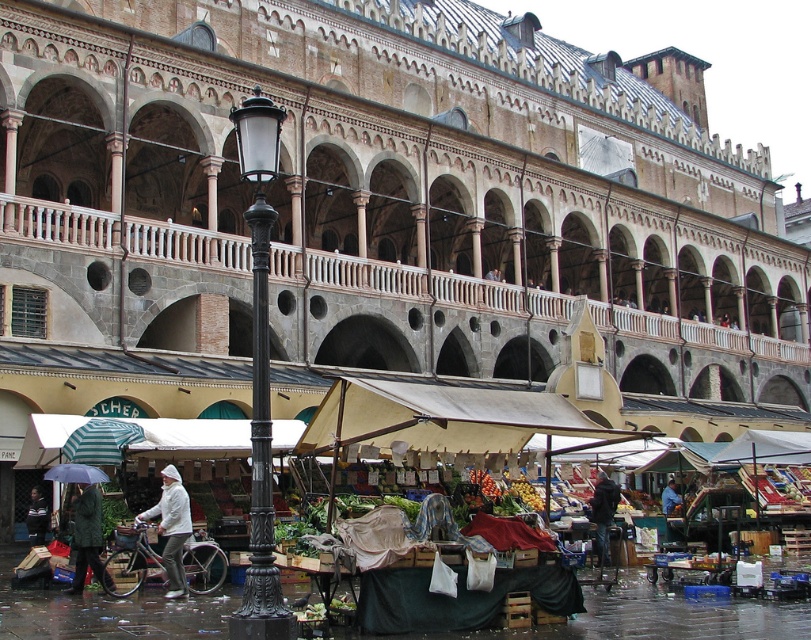
Can you confirm if white matte jacket at center is positioned below dark gray sweater at lower left?

No, white matte jacket at center is not below dark gray sweater at lower left.

Where is `white matte jacket at center`? This screenshot has width=811, height=640. white matte jacket at center is located at coordinates (170, 528).

Measure the distance between dark blue jacket at lower center and transparent nylon umbrella at lower left.

dark blue jacket at lower center and transparent nylon umbrella at lower left are 74.72 feet apart.

What do you see at coordinates (603, 512) in the screenshot? I see `dark blue jacket at lower center` at bounding box center [603, 512].

Locate an element on the screen. dark blue jacket at lower center is located at coordinates (603, 512).

Can you confirm if black cast iron streetlight at center is bigger than camouflage jacket at lower left?

Yes.

Which is more to the left, black cast iron streetlight at center or camouflage jacket at lower left?

Positioned to the left is camouflage jacket at lower left.

I want to click on black cast iron streetlight at center, so click(260, 376).